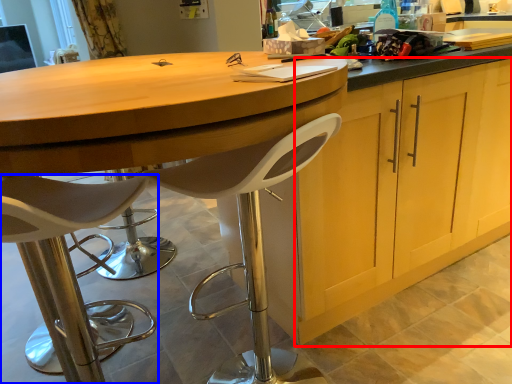
Question: Which point is closer to the camera, cabinetry (highlighted by a red box) or chair (highlighted by a blue box)?

Choices:
 (A) cabinetry
 (B) chair

Answer: (B)